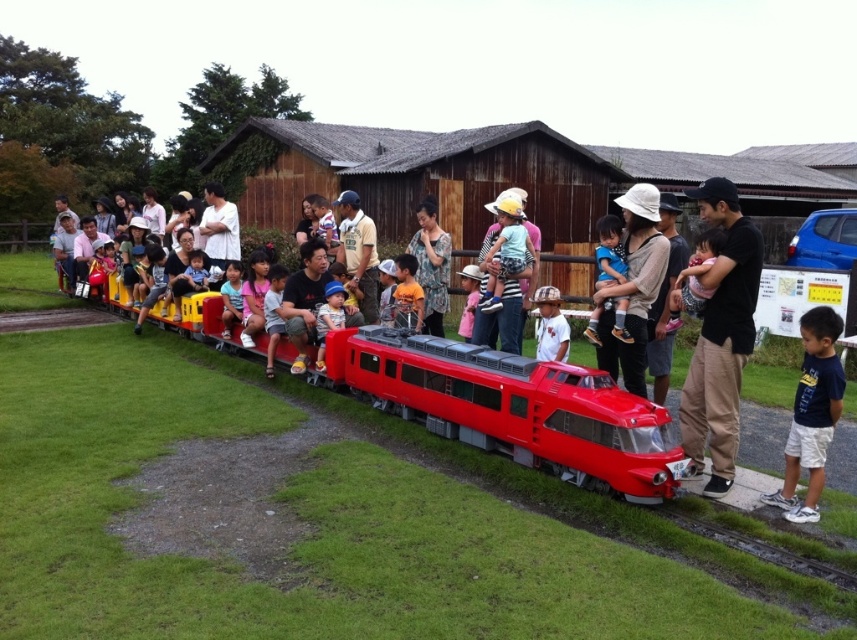
Does black matte shirt at right have a larger size compared to matte yellow shirt at center?

Yes, black matte shirt at right is bigger than matte yellow shirt at center.

Is black matte shirt at right below matte yellow shirt at center?

Indeed, black matte shirt at right is positioned under matte yellow shirt at center.

Between point (762, 244) and point (400, 301), which one is positioned behind?

The point (400, 301) is more distant.

Where is `black matte shirt at right`? This screenshot has height=640, width=857. black matte shirt at right is located at coordinates click(720, 337).

Is point (680, 420) positioned after point (319, 346)?

No, it is not.

Consider the image. Can you confirm if black matte shirt at right is positioned above matte plastic toy at center?

Incorrect, black matte shirt at right is not positioned above matte plastic toy at center.

Measure the distance between black matte shirt at right and camera.

black matte shirt at right is 4.29 meters away from camera.

Identify the location of black matte shirt at right. (720, 337).

Does shiny plastic train at center have a lesser height compared to matte yellow shirt at center?

No, shiny plastic train at center is not shorter than matte yellow shirt at center.

Which is in front, point (640, 413) or point (406, 272)?

Point (640, 413) is more forward.

Is point (333, 372) more distant than point (399, 317)?

No, (333, 372) is in front of (399, 317).

Image resolution: width=857 pixels, height=640 pixels. What are the coordinates of `shiny plastic train at center` in the screenshot? It's located at (514, 406).